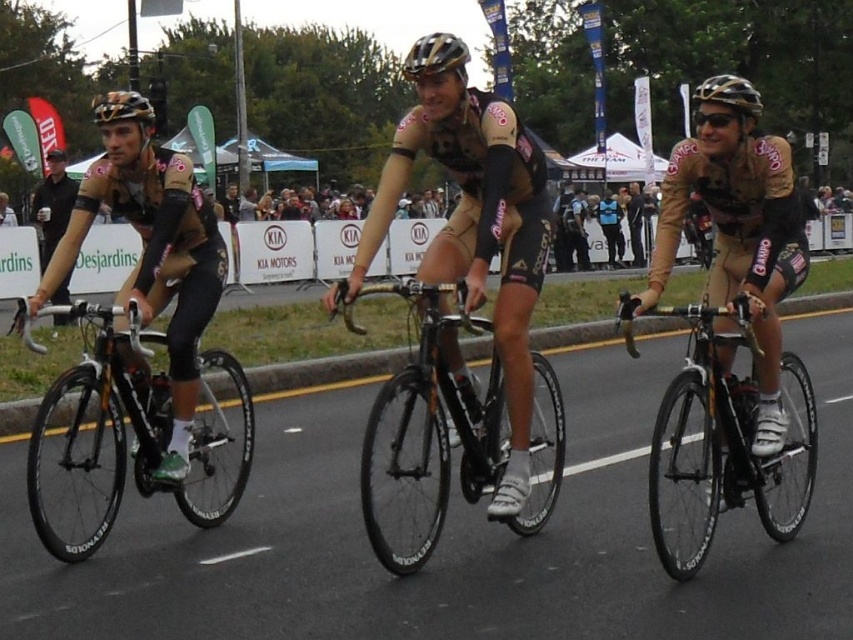
You are a photographer positioned at the starting line of the race. You want to capture a photo where the shiny gold bicycle at center is clearly visible above the matte black helmet at left. Is this possible given their current positions?

The shiny gold bicycle at center has a lesser height compared to matte black helmet at left, so it cannot be positioned to be clearly visible above the matte black helmet at left in the current arrangement.

You are a cyclist participating in a race and you notice two items at the center of your view. One is the black matte bicycle at center and the other is the matte black helmet at center. Which item is narrower in width?

The black matte bicycle at center has a lesser width compared to the matte black helmet at center, so the black matte bicycle at center is narrower.

Based on the photo, you are a photographer standing at the starting line of the race. You want to take a photo that includes both the shiny gold bicycle at center and the gold metallic helmet at upper left. The minimum distance between the two objects to fit in the frame is 15 feet. Will you be able to capture both in a single shot?

The shiny gold bicycle at center is 14.93 feet away from the gold metallic helmet at upper left, which is less than the required 15 feet. Therefore, you can capture both in a single shot since they are within the minimum distance requirement.